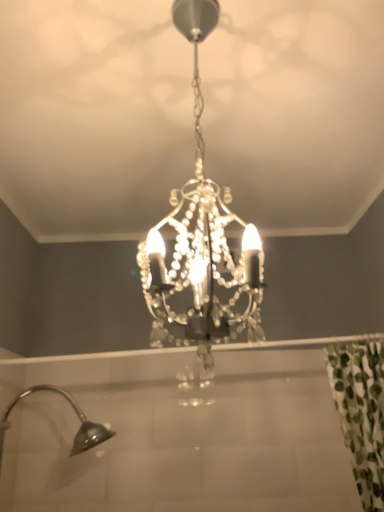
Measure the distance between point (155, 237) and camera.

Point (155, 237) and camera are 34.29 inches apart.

The image size is (384, 512). Describe the element at coordinates (201, 238) in the screenshot. I see `clear crystal chandelier at center` at that location.

This screenshot has width=384, height=512. Find the location of `clear crystal chandelier at center`. clear crystal chandelier at center is located at coordinates (201, 238).

What is the approximate width of clear crystal chandelier at center?

12.84 inches.

At what (x,y) coordinates should I click in order to perform the action: click on clear crystal chandelier at center. Please return your answer as a coordinate pair (x, y). Looking at the image, I should click on (201, 238).